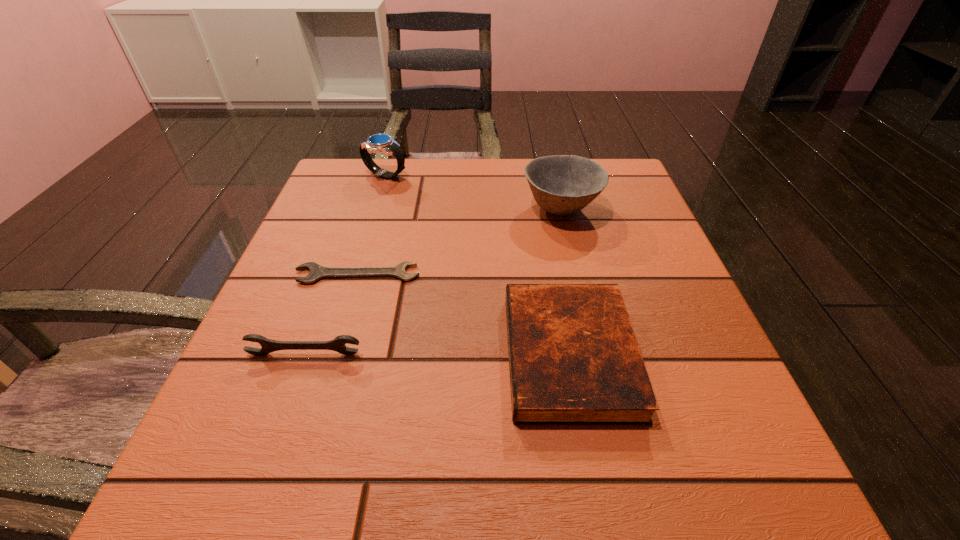
Identify the location of watch. (378, 143).

Locate an element on the screen. the second farthest object is located at coordinates (561, 184).

Locate an element on the screen. The width and height of the screenshot is (960, 540). the taller wrench is located at coordinates (338, 344).

Locate an element on the screen. The width and height of the screenshot is (960, 540). Bible is located at coordinates (574, 359).

Identify the location of the shorter wrench. (317, 271).

Where is `the shortest object`? The image size is (960, 540). the shortest object is located at coordinates (317, 271).

What are the coordinates of `vacant region located on the front of the farthest object` in the screenshot? It's located at pos(379,194).

Locate an element on the screen. Image resolution: width=960 pixels, height=540 pixels. free spot located 0.390m on the left of the fourth nearest object is located at coordinates (346, 208).

Where is `vacant area situated 0.080m on the open ends of the taller wrench`? This screenshot has height=540, width=960. vacant area situated 0.080m on the open ends of the taller wrench is located at coordinates (288, 402).

The height and width of the screenshot is (540, 960). Identify the location of vacant region located on the spine side of the Bible. (250, 355).